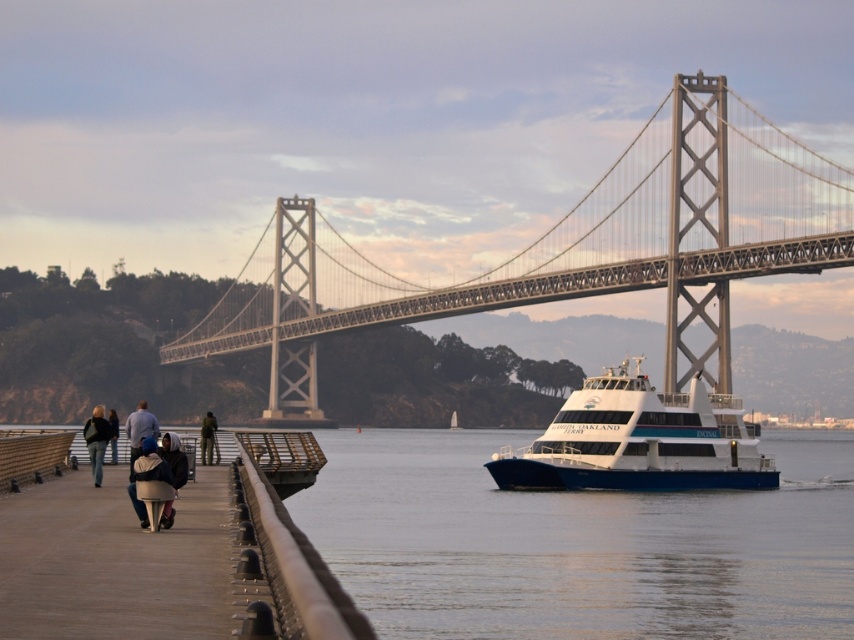
Which is below, transparent water at center or light gray jacket at left?

transparent water at center is below.

Can you confirm if transparent water at center is bigger than light gray jacket at left?

Actually, transparent water at center might be smaller than light gray jacket at left.

Between point (838, 477) and point (130, 467), which one is positioned behind?

The point (838, 477) is behind.

At what (x,y) coordinates should I click in order to perform the action: click on transparent water at center. Please return your answer as a coordinate pair (x, y). Looking at the image, I should click on (578, 545).

Between transparent water at center and dark blue jacket at left, which one is positioned higher?

dark blue jacket at left

Is transparent water at center to the right of dark blue jacket at left from the viewer's perspective?

Yes, transparent water at center is to the right of dark blue jacket at left.

Is point (548, 595) positioned before point (112, 417)?

No, it is not.

In order to click on transparent water at center in this screenshot , I will do `click(578, 545)`.

Describe the element at coordinates (97, 440) in the screenshot. I see `dark gray jacket at left` at that location.

Looking at this image, can you confirm if dark gray jacket at left is wider than green fabric jacket at left?

Yes, dark gray jacket at left is wider than green fabric jacket at left.

The width and height of the screenshot is (854, 640). What are the coordinates of `dark gray jacket at left` in the screenshot? It's located at (97, 440).